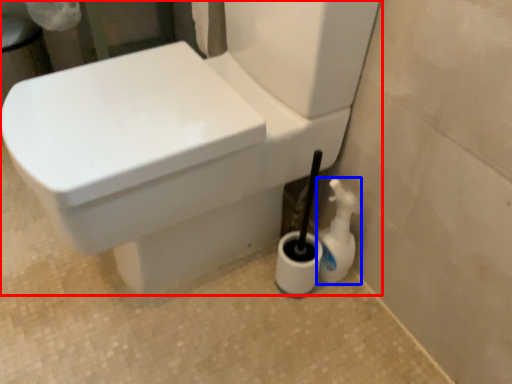
Question: Which object appears closest to the camera in this image, toilet (highlighted by a red box) or cleaning product (highlighted by a blue box)?

Choices:
 (A) toilet
 (B) cleaning product

Answer: (A)